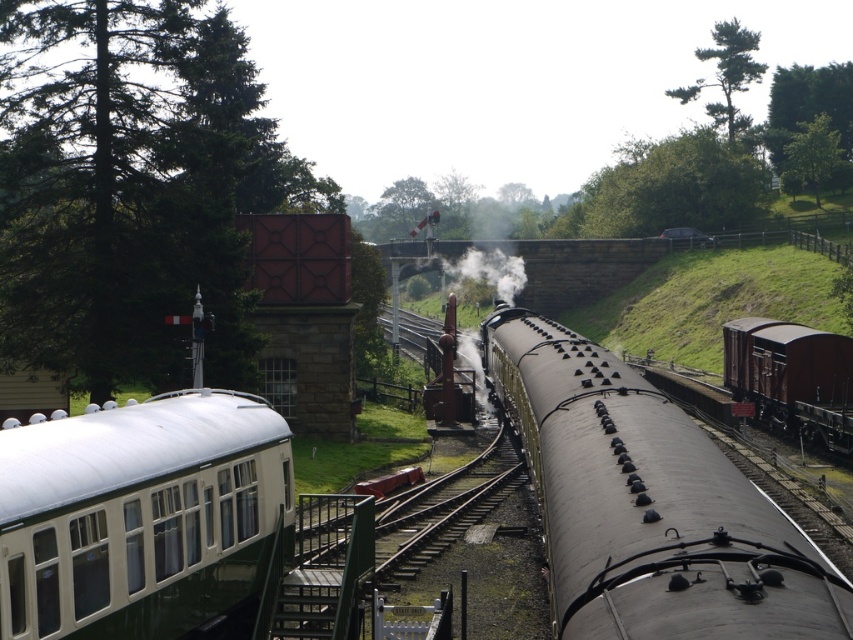
Is green leafy tree at upper left shorter than green leafy tree at upper right?

In fact, green leafy tree at upper left may be taller than green leafy tree at upper right.

Is point (19, 157) positioned before point (827, 118)?

Yes, point (19, 157) is in front of point (827, 118).

Where is `green leafy tree at upper left`? green leafy tree at upper left is located at coordinates (131, 186).

Does green leafy tree at upper left have a smaller size compared to brown matte freight car at right?

Actually, green leafy tree at upper left might be larger than brown matte freight car at right.

Can you confirm if green leafy tree at upper left is positioned below brown matte freight car at right?

No, green leafy tree at upper left is not below brown matte freight car at right.

The height and width of the screenshot is (640, 853). I want to click on green leafy tree at upper left, so click(131, 186).

Find the location of a particular element. The width and height of the screenshot is (853, 640). green leafy tree at upper left is located at coordinates (131, 186).

The image size is (853, 640). Find the location of `green leafy tree at upper left`. green leafy tree at upper left is located at coordinates (131, 186).

Is point (154, 29) farther from viewer compared to point (9, 509)?

Yes, point (154, 29) is farther from viewer.

Where is `green leafy tree at upper left`? The image size is (853, 640). green leafy tree at upper left is located at coordinates (131, 186).